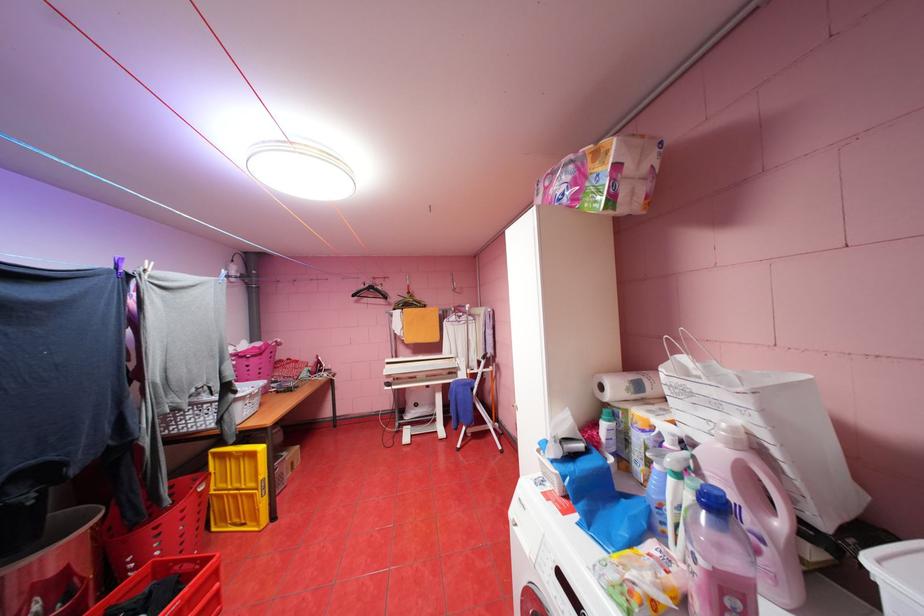
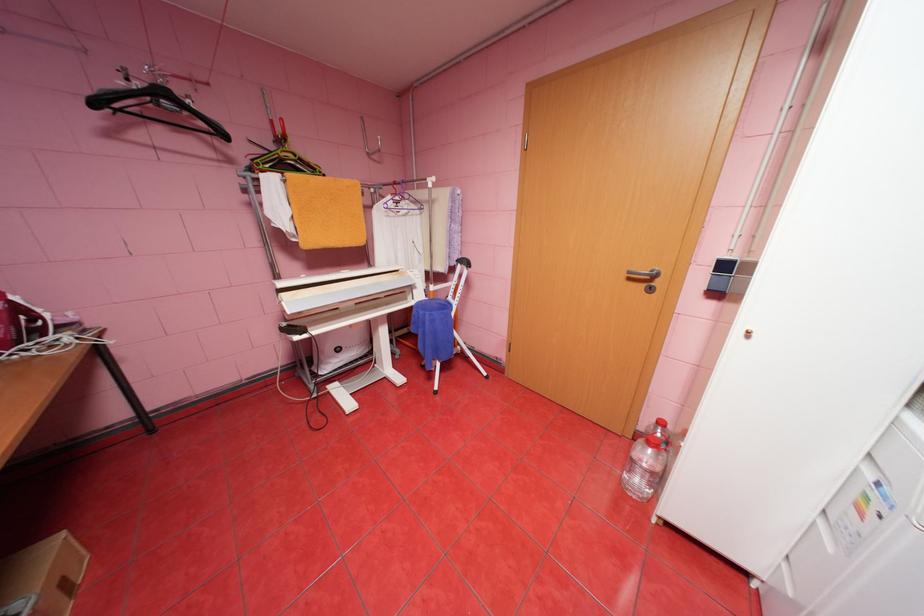
In the second image, find the point that corresponds to point (361, 294) in the first image.

(103, 103)